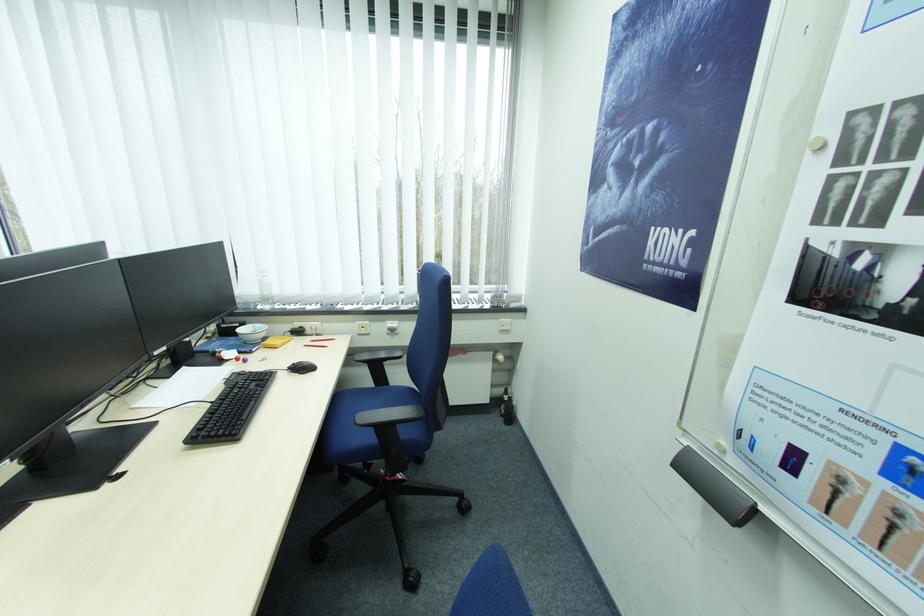
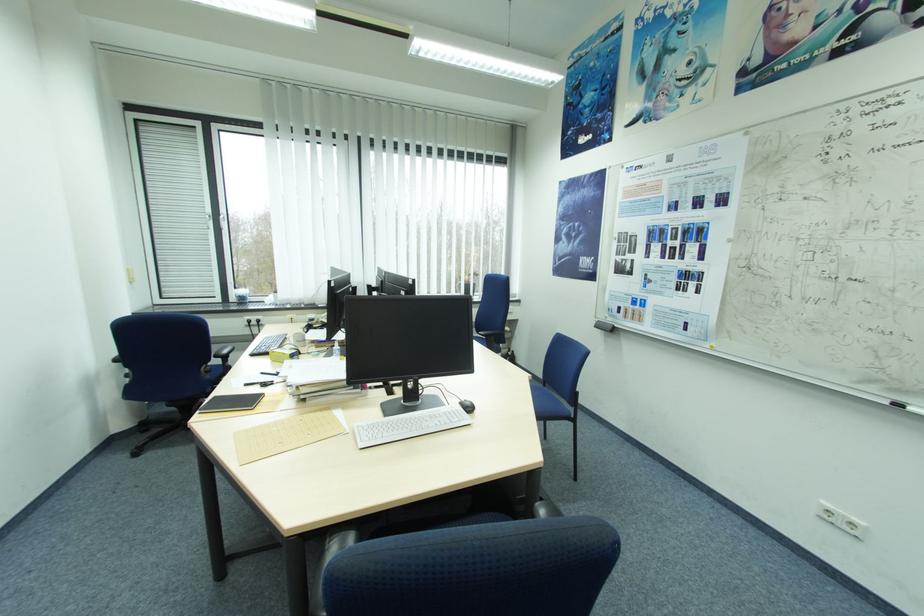
In a continuous first-person perspective shot, in which direction is the camera moving?

The cameraman moved toward left, backward.